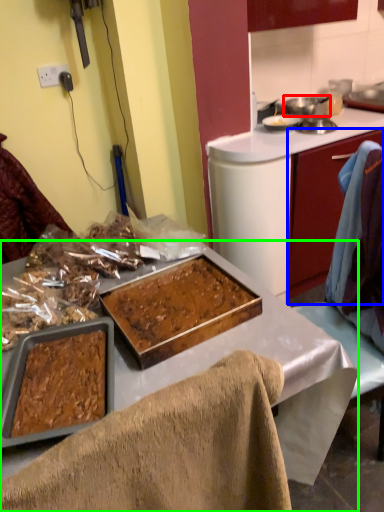
Question: Which object is the closest to the pot/pan (highlighted by a red box)? Choose among these: cabinetry (highlighted by a blue box) or desk (highlighted by a green box).

Choices:
 (A) cabinetry
 (B) desk

Answer: (A)